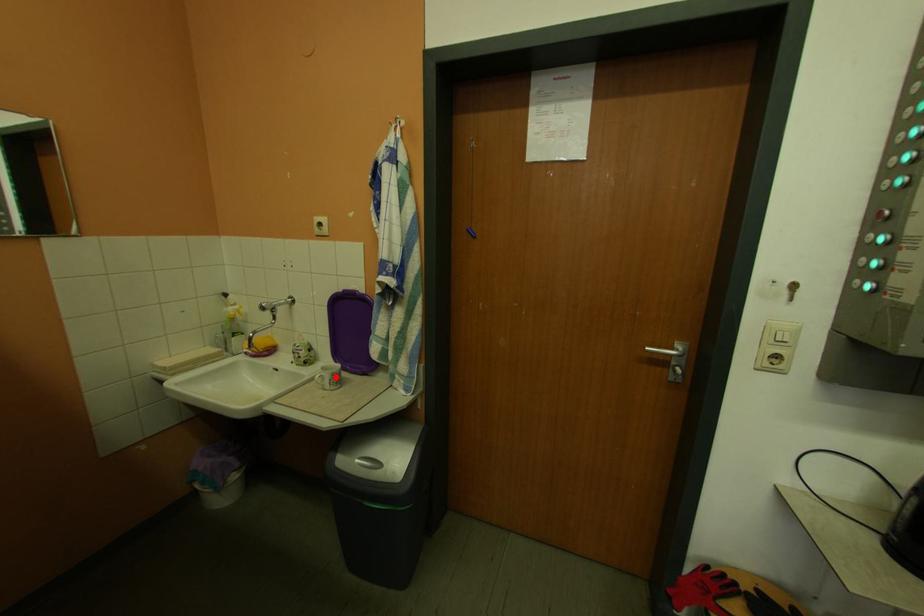
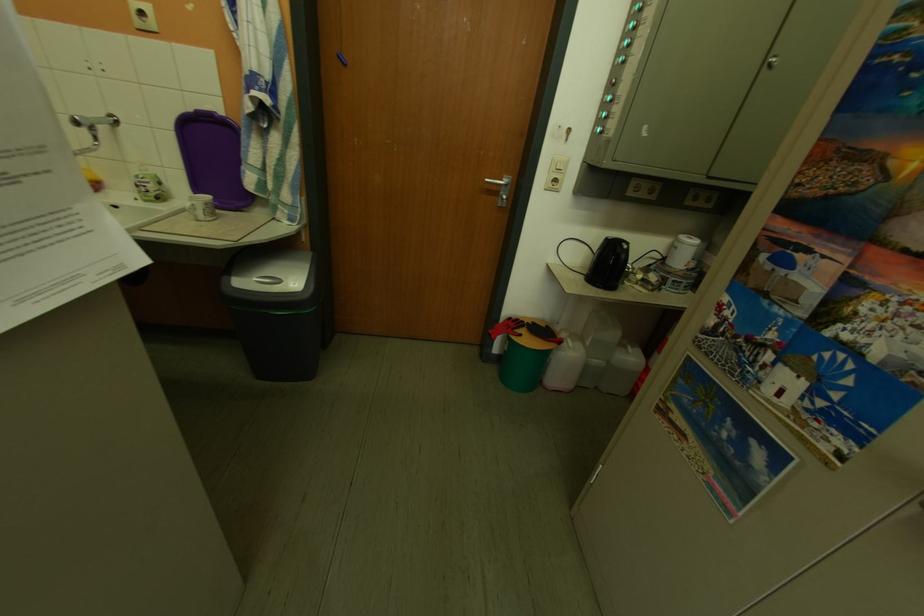
Where in the second image is the point corresponding to the highlighted location from the first image?

(207, 206)